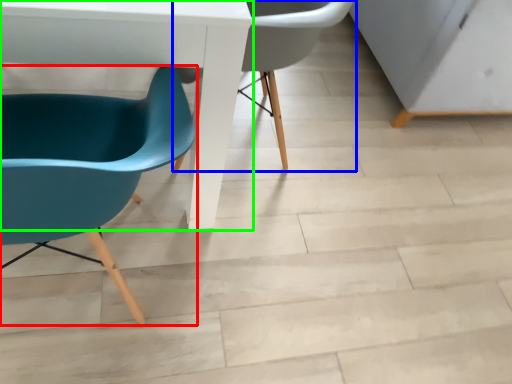
Question: Considering the real-world distances, which object is farthest from chair (highlighted by a red box)? chair (highlighted by a blue box) or table (highlighted by a green box)?

Choices:
 (A) chair
 (B) table

Answer: (A)